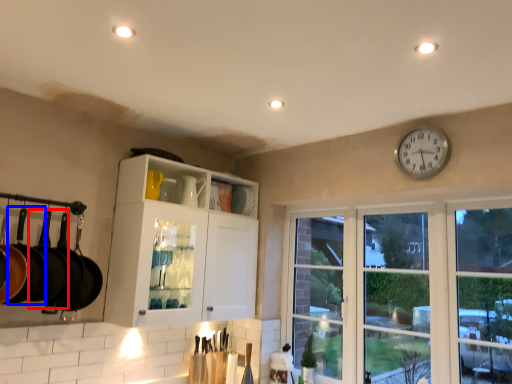
Question: Which of the following is the farthest to the observer, frying pan (highlighted by a red box) or frying pan (highlighted by a blue box)?

Choices:
 (A) frying pan
 (B) frying pan

Answer: (A)